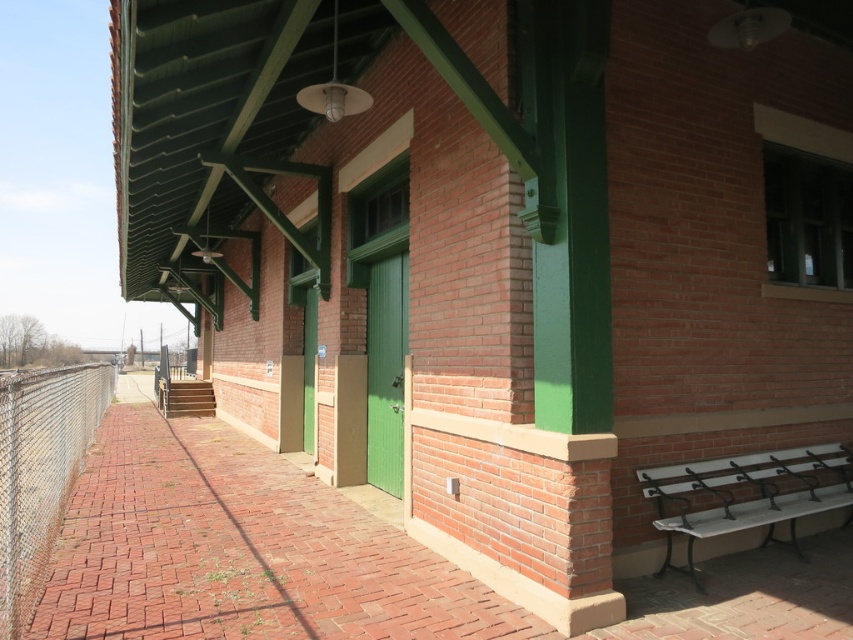
Between chain-link fence at left and white metal bench at lower right, which one appears on the left side from the viewer's perspective?

chain-link fence at left is more to the left.

Does chain-link fence at left appear on the left side of white metal bench at lower right?

Yes, chain-link fence at left is to the left of white metal bench at lower right.

The image size is (853, 640). What do you see at coordinates (39, 472) in the screenshot?
I see `chain-link fence at left` at bounding box center [39, 472].

Where is `chain-link fence at left`? The image size is (853, 640). chain-link fence at left is located at coordinates (39, 472).